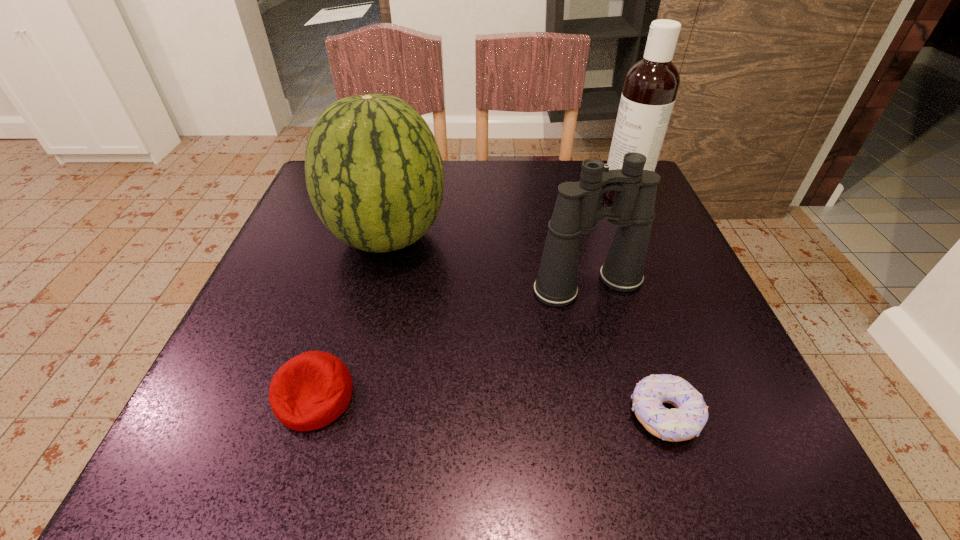
What are the coordinates of `the tallest object` in the screenshot? It's located at (651, 85).

In order to click on watermelon in this screenshot , I will do `click(374, 173)`.

Where is `binoculars`? The image size is (960, 540). binoculars is located at coordinates [x=577, y=210].

Locate an element on the screen. This screenshot has width=960, height=540. the second shortest object is located at coordinates (311, 390).

Find the location of a particular element. Image resolution: width=960 pixels, height=540 pixels. doughnut is located at coordinates (685, 421).

This screenshot has height=540, width=960. What are the coordinates of `vacant space located 0.120m on the label side of the tallest object` in the screenshot? It's located at (551, 194).

At what (x,y) coordinates should I click in order to perform the action: click on vacant region located 0.190m on the label side of the tallest object. Please return your answer as a coordinate pair (x, y). The width and height of the screenshot is (960, 540). Looking at the image, I should click on (522, 194).

Locate an element on the screen. blank space located on the label side of the tallest object is located at coordinates (459, 194).

The image size is (960, 540). In order to click on blank space located 0.110m on the right of the watermelon in this screenshot , I will do `click(499, 237)`.

In order to click on vacant space located on the left of the binoculars in this screenshot , I will do `click(479, 285)`.